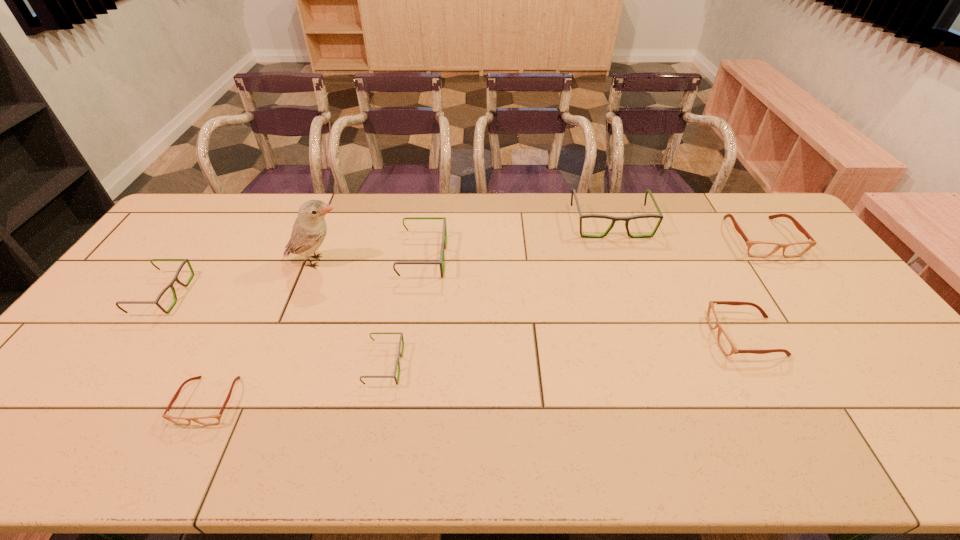
The height and width of the screenshot is (540, 960). What are the coordinates of `free spot between the second biggest black spectacles and the third object from right to left` in the screenshot? It's located at (516, 240).

Locate an element on the screen. The width and height of the screenshot is (960, 540). blank region between the smallest black spectacles and the rightmost brown spectacles is located at coordinates (572, 301).

You are a GUI agent. You are given a task and a screenshot of the screen. Output one action in this format:
    pyautogui.click(x=<x>, y=<y>)
    Task: Click on the free space between the leftmost black spectacles and the tallest spectacles
    The image size is (960, 540).
    Given the screenshot: What is the action you would take?
    pyautogui.click(x=387, y=259)

The height and width of the screenshot is (540, 960). What are the coordinates of `blank region between the nearest black spectacles and the second object from right to left` in the screenshot? It's located at (564, 350).

This screenshot has height=540, width=960. What are the coordinates of `the sixth closest object to the leftmost brown spectacles` in the screenshot? It's located at (726, 345).

Where is `object that is the second nearest to the second biggest black spectacles`? object that is the second nearest to the second biggest black spectacles is located at coordinates (400, 354).

Point out which spectacles is positioned as the nearest to the leftmost brown spectacles. Please provide its 2D coordinates. Your answer should be formatted as a tuple, i.e. [(x, y)], where the tuple contains the x and y coordinates of a point satisfying the conditions above.

[(175, 278)]

Identify which spectacles is the fifth nearest to the fifth spectacles from left to right. Please provide its 2D coordinates. Your answer should be formatted as a tuple, i.e. [(x, y)], where the tuple contains the x and y coordinates of a point satisfying the conditions above.

[(213, 419)]

Identify which black spectacles is located as the nearest to the nearest black spectacles. Please provide its 2D coordinates. Your answer should be formatted as a tuple, i.e. [(x, y)], where the tuple contains the x and y coordinates of a point satisfying the conditions above.

[(441, 262)]

Identify which black spectacles is the second nearest to the second biggest black spectacles. Please provide its 2D coordinates. Your answer should be formatted as a tuple, i.e. [(x, y)], where the tuple contains the x and y coordinates of a point satisfying the conditions above.

[(614, 219)]